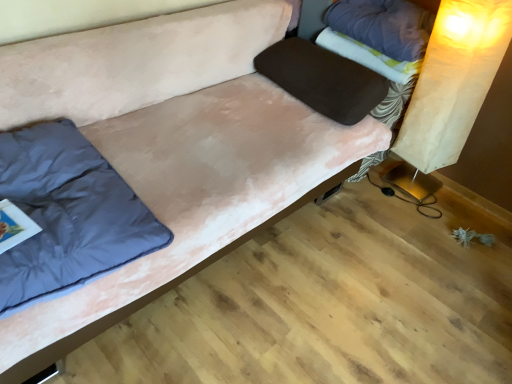
Question: From the image's perspective, relative to matte paper lampshade at right, is dark blue fabric pillow at left, the first pillow from the left, above or below?

Choices:
 (A) below
 (B) above

Answer: (A)

Question: Is dark blue fabric pillow at left, the first pillow from the left, bigger or smaller than matte paper lampshade at right?

Choices:
 (A) small
 (B) big

Answer: (A)

Question: Estimate the real-world distances between objects in this image. Which object is farther from the matte paper lampshade at right?

Choices:
 (A) dark blue fabric pillow at left, the first pillow from the left
 (B) purple fabric pillow at upper right, which is counted as the first pillow, starting from the right
 (C) velvet brown pillow at center, which is counted as the 2th pillow, starting from the left
 (D) fluffy white blanket at upper right

Answer: (A)

Question: Considering the real-world distances, which object is farthest from the matte paper lampshade at right?

Choices:
 (A) purple fabric pillow at upper right, which is the third pillow in left-to-right order
 (B) velvet brown pillow at center, which is counted as the 2th pillow, starting from the left
 (C) dark blue fabric pillow at left, marked as the 3th pillow in a right-to-left arrangement
 (D) fluffy white blanket at upper right

Answer: (C)